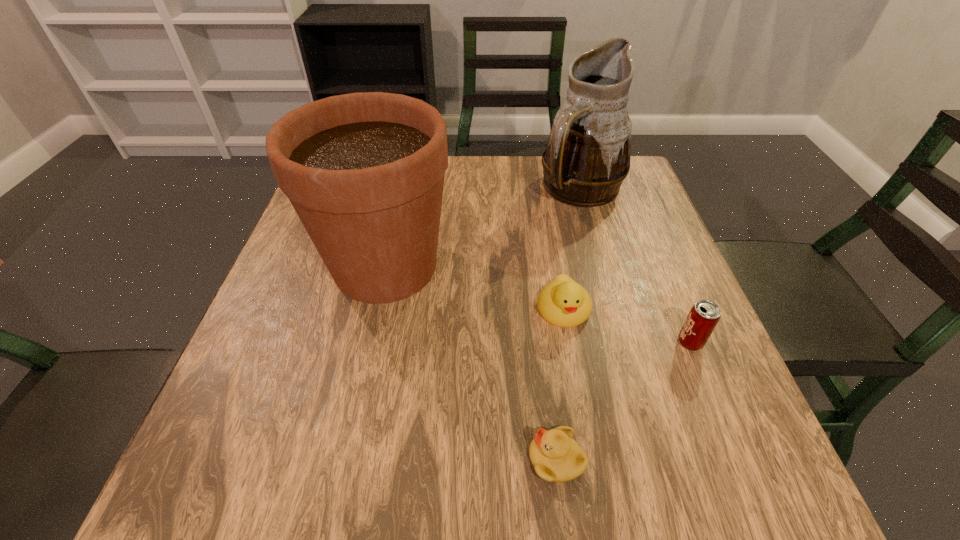
At what (x,y) coordinates should I click in order to perform the action: click on vacant space located 0.150m on the front-facing side of the shorter duckling. Please return your answer as a coordinate pair (x, y). Image resolution: width=960 pixels, height=540 pixels. Looking at the image, I should click on (431, 459).

At what (x,y) coordinates should I click in order to perform the action: click on vacant space located on the front-facing side of the shorter duckling. Please return your answer as a coordinate pair (x, y). Looking at the image, I should click on (346, 459).

I want to click on free space located on the front-facing side of the shorter duckling, so click(x=450, y=459).

This screenshot has height=540, width=960. Find the location of `object positioned at the far edge`. object positioned at the far edge is located at coordinates (587, 156).

This screenshot has width=960, height=540. In order to click on object that is positioned at the near edge in this screenshot , I will do `click(555, 455)`.

Locate an element on the screen. Image resolution: width=960 pixels, height=540 pixels. object that is at the left edge is located at coordinates (364, 172).

Image resolution: width=960 pixels, height=540 pixels. I want to click on pitcher located in the right edge section of the desktop, so click(587, 156).

The image size is (960, 540). In order to click on beer can that is positioned at the right edge in this screenshot , I will do `click(704, 315)`.

Find the location of a particular element. The height and width of the screenshot is (540, 960). object present at the far right corner is located at coordinates (587, 156).

Identify the location of vacant region at the far edge of the desktop. (535, 170).